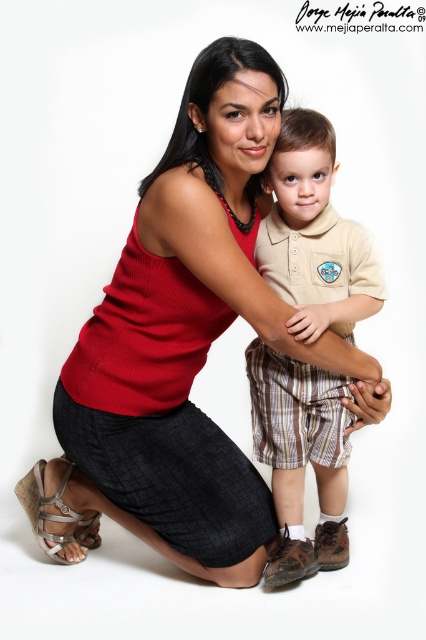
Question: Which of the following is the farthest from the observer?

Choices:
 (A) silver metallic sandal at lower left
 (B) beige cotton polo shirt at center
 (C) matte red tank top at center

Answer: (A)

Question: Which point is closer to the camera?

Choices:
 (A) matte red tank top at center
 (B) silver metallic sandal at lower left

Answer: (A)

Question: Can you confirm if matte red tank top at center is bigger than beige cotton polo shirt at center?

Choices:
 (A) no
 (B) yes

Answer: (B)

Question: Is matte red tank top at center positioned behind beige cotton polo shirt at center?

Choices:
 (A) yes
 (B) no

Answer: (B)

Question: Based on their relative distances, which object is nearer to the beige cotton polo shirt at center?

Choices:
 (A) silver metallic sandal at lower left
 (B) matte red tank top at center

Answer: (B)

Question: Is beige cotton polo shirt at center to the left of silver metallic sandal at lower left from the viewer's perspective?

Choices:
 (A) no
 (B) yes

Answer: (A)